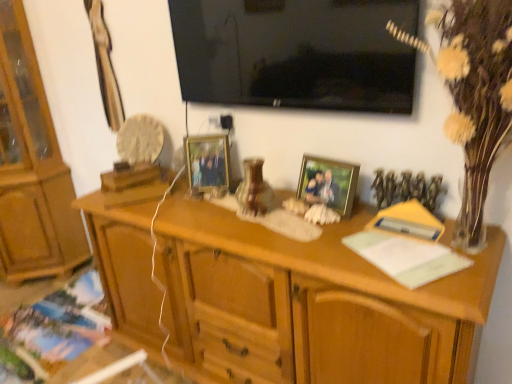
Question: Considering the positions of white textured vase at right and matte paper book at lower left, the third book in the front-to-back sequence, in the image, is white textured vase at right wider or thinner than matte paper book at lower left, the third book in the front-to-back sequence,?

Choices:
 (A) wide
 (B) thin

Answer: (B)

Question: From the image's perspective, is white textured vase at right positioned above or below matte paper book at lower left, arranged as the 3th book when viewed from the right?

Choices:
 (A) above
 (B) below

Answer: (A)

Question: Which of these objects is positioned farthest from the yellow paper at right, which is counted as the 2th book, starting from the back?

Choices:
 (A) white paper at right, placed as the 2th book when sorted from right to left
 (B) wooden desk at center
 (C) matte wooden picture frame at center, which is counted as the second picture frame, starting from the front
 (D) white textured vase at right
 (E) light brown wood cabinet at left

Answer: (E)

Question: Considering the real-world distances, which object is farthest from the white textured vase at right?

Choices:
 (A) yellow paper at right, positioned as the third book in bottom-to-top order
 (B) black glossy tv at upper center
 (C) light brown wood cabinet at left
 (D) white paper at right, arranged as the 3th book when viewed from the back
 (E) wooden desk at center

Answer: (C)